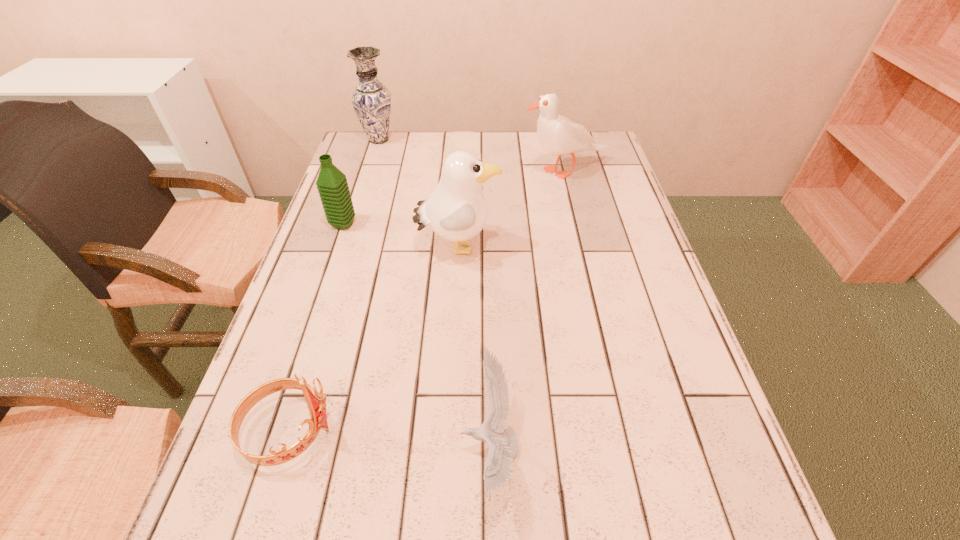
Where is `vase`? This screenshot has width=960, height=540. vase is located at coordinates (371, 100).

This screenshot has height=540, width=960. In order to click on the second nearest gull in this screenshot , I will do `click(457, 210)`.

What are the coordinates of `the rightmost object` in the screenshot? It's located at (557, 135).

The width and height of the screenshot is (960, 540). Find the location of `the rightmost gull`. the rightmost gull is located at coordinates (557, 135).

Where is `water bottle`? water bottle is located at coordinates (332, 185).

The height and width of the screenshot is (540, 960). Identify the location of the second shortest object. pos(316,401).

Find the location of a particular element. The width and height of the screenshot is (960, 540). the shortest gull is located at coordinates (503, 442).

Identify the location of the nearest gull. (x=503, y=442).

Identify the location of blank area located 0.250m on the front of the vase. pyautogui.click(x=362, y=194).

Where is `free space located on the beak of the second farthest gull`? free space located on the beak of the second farthest gull is located at coordinates (614, 248).